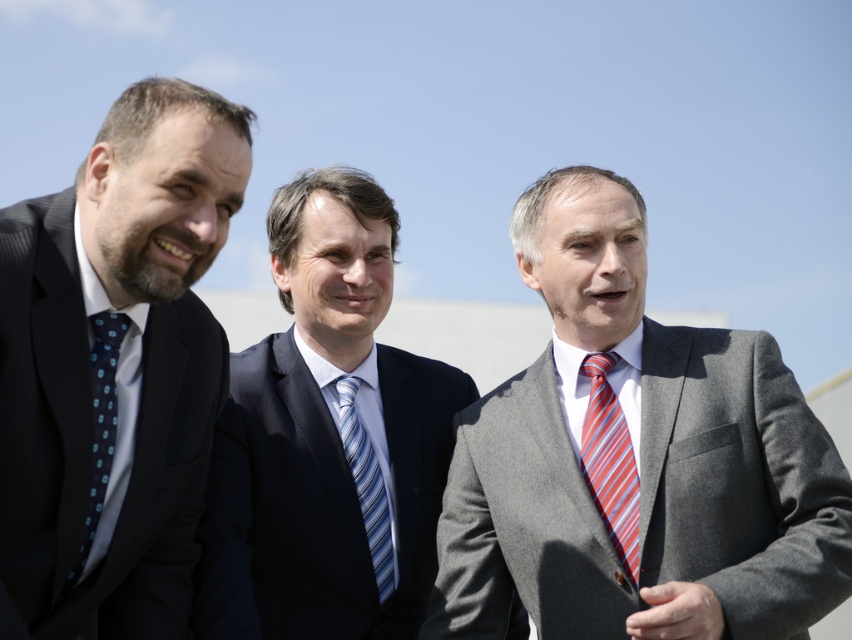
From the picture: You are standing at the camera position and want to throw a frisbee to the dark blue pinstripe suit at left. Is the distance within a typical frisbee throw range?

The distance between you and the dark blue pinstripe suit at left is 72.85 feet. A typical frisbee throw range is around 50 to 100 feet, so yes, it is within range.

You are a fashion designer observing three men in suits. You need to determine which suit has a wider cut between the gray wool suit at center and the dark blue pinstripe suit at left. Which one is wider?

The gray wool suit at center has a wider cut than the dark blue pinstripe suit at left because its width is larger according to the description.

You are a photographer trying to capture a clear shot of both the dark blue pinstripe suit at left and the blue dotted tie at left. Since you want to ensure both are visible in your frame, which object should you focus on first to account for their positions?

The dark blue pinstripe suit at left is positioned on the right side of the blue dotted tie at left, so you should focus on the blue dotted tie at left first as it is closer to the left edge of the frame to ensure both are in view.